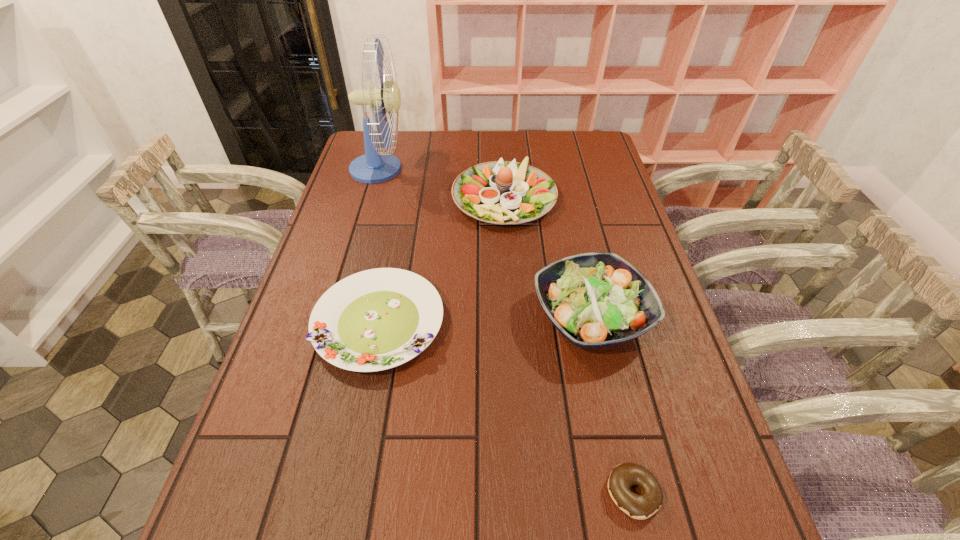
Identify the location of free space between the tallest object and the farthest salad plate. (442, 183).

At what (x,y) coordinates should I click in order to perform the action: click on free space that is in between the fan and the shortest salad plate. Please return your answer as a coordinate pair (x, y). Looking at the image, I should click on (379, 246).

Where is `vacant area that lies between the farthest salad plate and the shortest object`? The width and height of the screenshot is (960, 540). vacant area that lies between the farthest salad plate and the shortest object is located at coordinates (568, 345).

In order to click on vacant area that lies between the tallest object and the farthest salad plate in this screenshot , I will do `click(442, 183)`.

Locate an element on the screen. The width and height of the screenshot is (960, 540). unoccupied position between the farthest salad plate and the doughnut is located at coordinates (568, 345).

Point out which object is positioned as the nearest to the farthest salad plate. Please provide its 2D coordinates. Your answer should be formatted as a tuple, i.e. [(x, y)], where the tuple contains the x and y coordinates of a point satisfying the conditions above.

[(374, 166)]

Where is `object that stands as the closest to the shortest object`? The width and height of the screenshot is (960, 540). object that stands as the closest to the shortest object is located at coordinates (595, 300).

Select which salad plate is the closest to the farthest salad plate. Please provide its 2D coordinates. Your answer should be formatted as a tuple, i.e. [(x, y)], where the tuple contains the x and y coordinates of a point satisfying the conditions above.

[(595, 300)]

The height and width of the screenshot is (540, 960). Find the location of `salad plate that stands as the closest to the farthest salad plate`. salad plate that stands as the closest to the farthest salad plate is located at coordinates (595, 300).

Identify the location of vacant space that satisfies the following two spatial constraints: 1. at the front of the fan where the blades are visible; 2. on the back side of the shortest object. (286, 493).